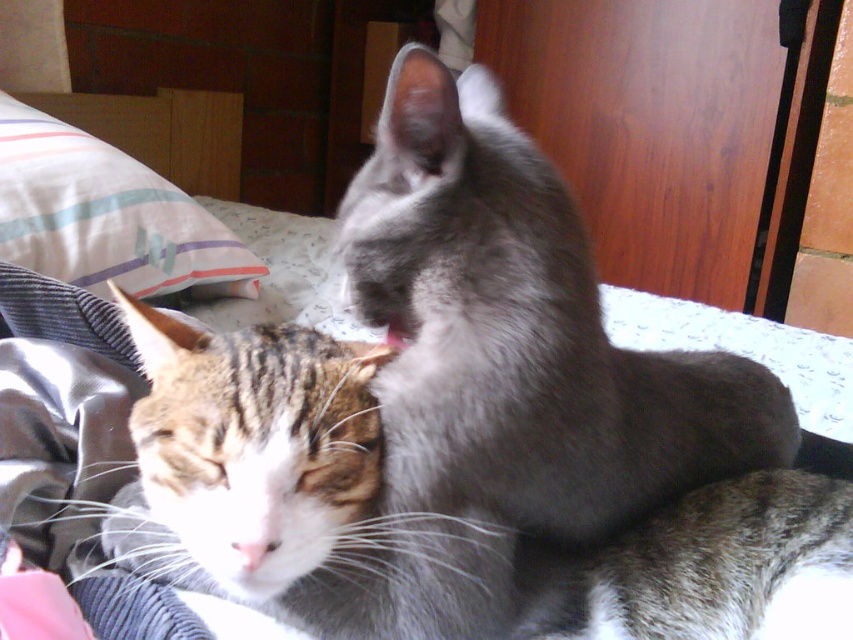
Between point (583, 460) and point (280, 324), which one is positioned behind?

Point (280, 324)

Which is more to the left, gray fluffy cat at center or tabby fur cat at center?

tabby fur cat at center

Between point (788, 417) and point (234, 438), which one is positioned in front?

Positioned in front is point (234, 438).

The image size is (853, 640). I want to click on gray fluffy cat at center, so click(x=520, y=333).

Is tabby fur cat at center smaller than white striped fabric at upper left?

Correct, tabby fur cat at center occupies less space than white striped fabric at upper left.

Does tabby fur cat at center have a greater height compared to white striped fabric at upper left?

Incorrect, tabby fur cat at center's height is not larger of white striped fabric at upper left's.

Identify the location of tabby fur cat at center. (225, 438).

Between gray fluffy cat at center and white striped fabric at upper left, which one appears on the right side from the viewer's perspective?

From the viewer's perspective, gray fluffy cat at center appears more on the right side.

Is gray fluffy cat at center positioned behind white striped fabric at upper left?

No, it is in front of white striped fabric at upper left.

Who is more forward, (410,387) or (39,161)?

Point (410,387) is in front.

Locate an element on the screen. The width and height of the screenshot is (853, 640). gray fluffy cat at center is located at coordinates (520, 333).